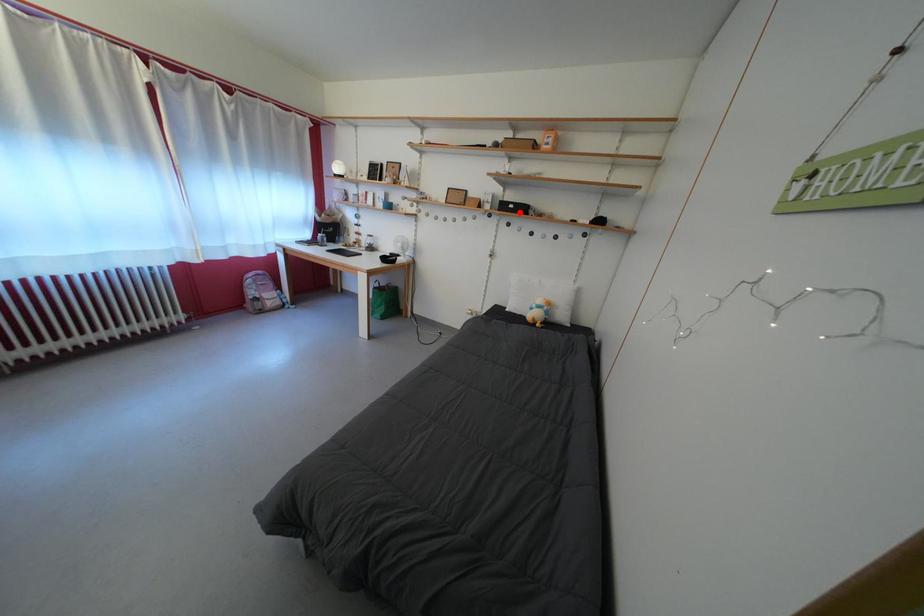
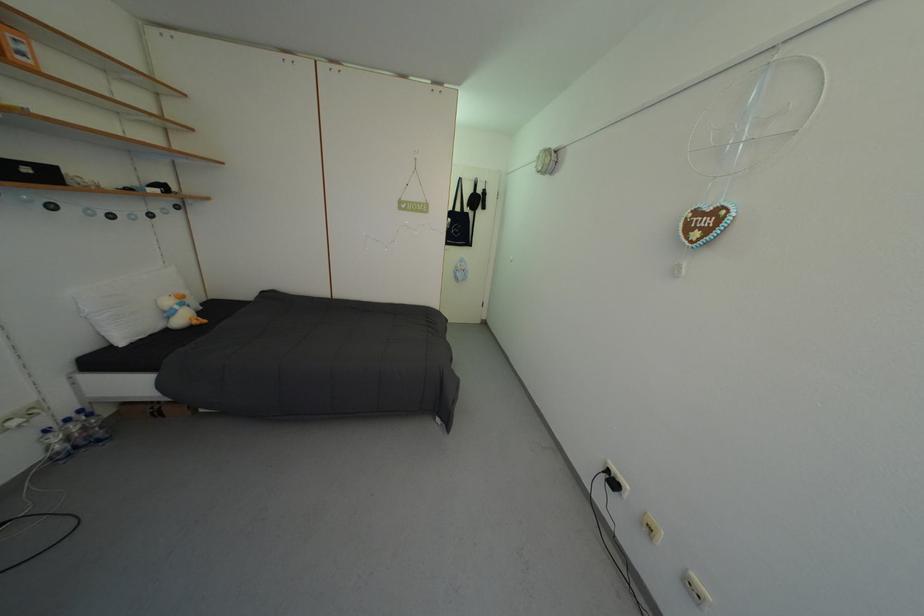
Find the pixel in the second image that matches the highlighted location in the first image.

(35, 176)